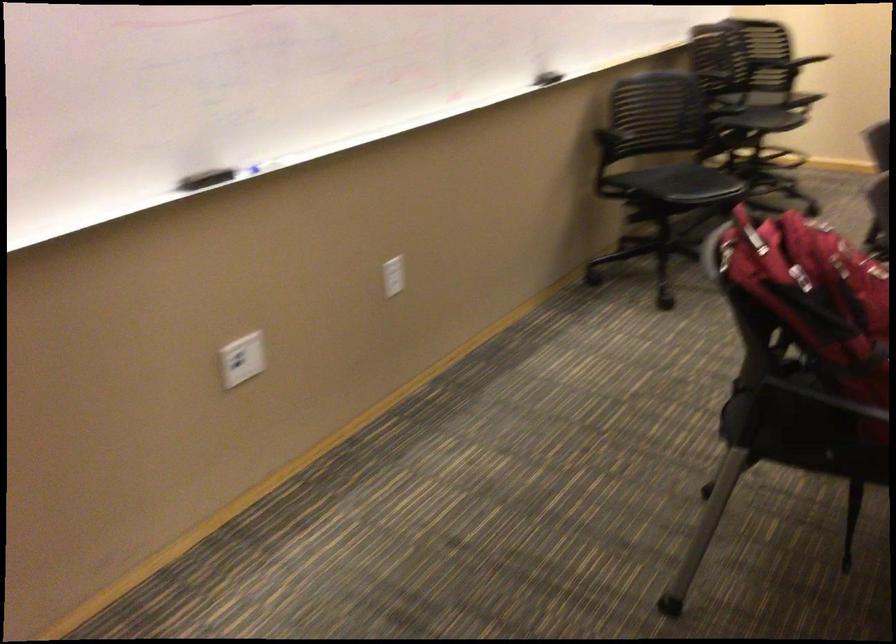
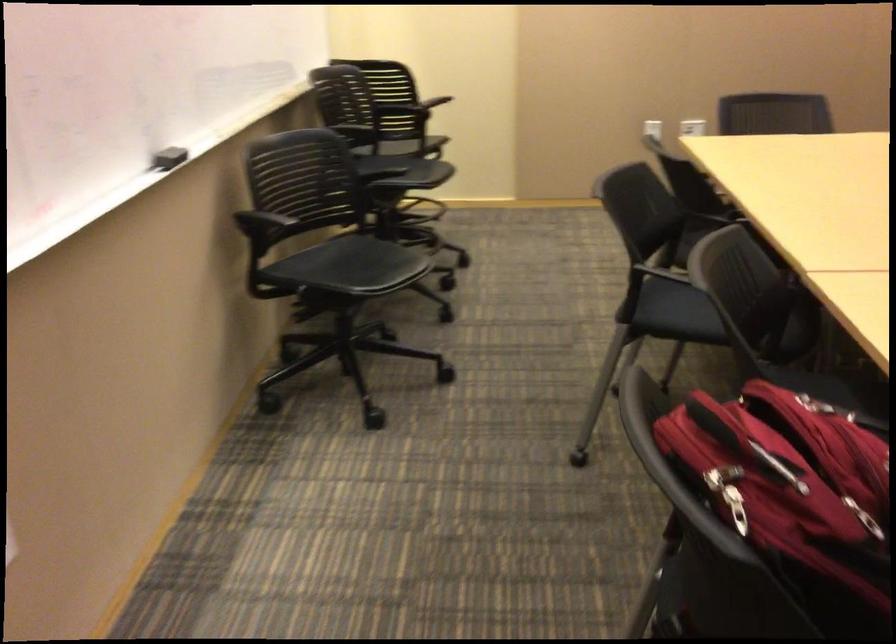
Question: The first image is from the beginning of the video and the second image is from the end. How did the camera likely rotate when shooting the video?

Choices:
 (A) Left
 (B) Right
 (C) Up
 (D) Down

Answer: (B)